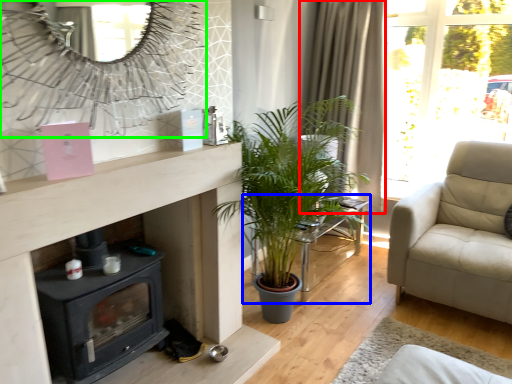
Question: Which object is the farthest from curtain (highlighted by a red box)? Choose among these: table (highlighted by a blue box) or mirror (highlighted by a green box).

Choices:
 (A) table
 (B) mirror

Answer: (B)